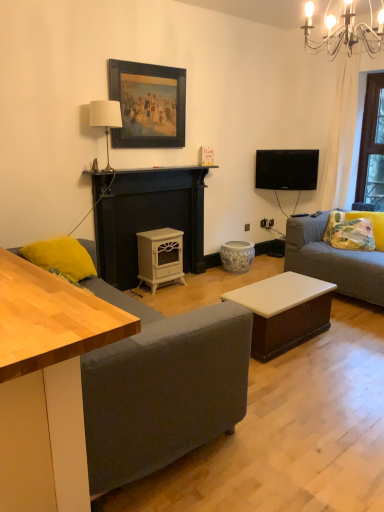
Question: From the image's perspective, is light wood desk at left below metallic chandelier at upper right?

Choices:
 (A) yes
 (B) no

Answer: (A)

Question: Does light wood desk at left appear on the left side of metallic chandelier at upper right?

Choices:
 (A) no
 (B) yes

Answer: (B)

Question: From the image's perspective, would you say light wood desk at left is positioned over metallic chandelier at upper right?

Choices:
 (A) yes
 (B) no

Answer: (B)

Question: Is metallic chandelier at upper right surrounded by light wood desk at left?

Choices:
 (A) yes
 (B) no

Answer: (B)

Question: From a real-world perspective, is light wood desk at left located beneath metallic chandelier at upper right?

Choices:
 (A) yes
 (B) no

Answer: (A)

Question: From the image's perspective, relative to white glossy coffee table at center, is porcelain floral-patterned stool at center above or below?

Choices:
 (A) below
 (B) above

Answer: (B)

Question: Do you think porcelain floral-patterned stool at center is within white glossy coffee table at center, or outside of it?

Choices:
 (A) inside
 (B) outside

Answer: (B)

Question: Is porcelain floral-patterned stool at center taller or shorter than white glossy coffee table at center?

Choices:
 (A) tall
 (B) short

Answer: (B)

Question: Would you say porcelain floral-patterned stool at center is to the left or to the right of white glossy coffee table at center in the picture?

Choices:
 (A) left
 (B) right

Answer: (A)

Question: Considering their positions, is white fabric lampshade at upper center located in front of or behind white glossy coffee table at center?

Choices:
 (A) behind
 (B) front

Answer: (A)

Question: Is white fabric lampshade at upper center situated inside white glossy coffee table at center or outside?

Choices:
 (A) outside
 (B) inside

Answer: (A)

Question: Considering the positions of white fabric lampshade at upper center and white glossy coffee table at center in the image, is white fabric lampshade at upper center wider or thinner than white glossy coffee table at center?

Choices:
 (A) wide
 (B) thin

Answer: (B)

Question: From the image's perspective, is white fabric lampshade at upper center above or below white glossy coffee table at center?

Choices:
 (A) above
 (B) below

Answer: (A)

Question: Is light wood desk at left taller or shorter than black glossy tv at upper right?

Choices:
 (A) tall
 (B) short

Answer: (A)

Question: From a real-world perspective, relative to black glossy tv at upper right, is light wood desk at left vertically above or below?

Choices:
 (A) below
 (B) above

Answer: (A)